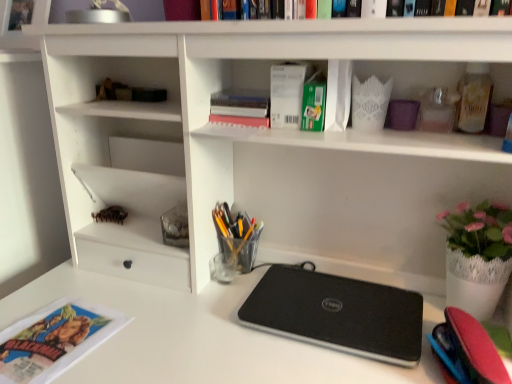
What do you see at coordinates (54, 340) in the screenshot? I see `matte paper magazine at lower left` at bounding box center [54, 340].

Find the location of a particular element. The height and width of the screenshot is (384, 512). translucent plastic cup at center is located at coordinates (237, 236).

What is the approximate width of black matte laptop at center?

It is 11.50 inches.

Locate an element on the screen. This screenshot has height=384, width=512. white matte paper at upper center, which appears as the 1th paperback book when viewed from the left is located at coordinates (287, 94).

Where is `matte paper magazine at lower left`? This screenshot has height=384, width=512. matte paper magazine at lower left is located at coordinates coord(54,340).

Considering the relative sizes of white matte paper at upper center, which appears as the 1th paperback book when viewed from the left, and translucent plastic cup at center in the image provided, is white matte paper at upper center, which appears as the 1th paperback book when viewed from the left, shorter than translucent plastic cup at center?

Indeed, white matte paper at upper center, which appears as the 1th paperback book when viewed from the left, has a lesser height compared to translucent plastic cup at center.

Is white matte paper at upper center, positioned as the 2th paperback book in right-to-left order, completely or partially outside of translucent plastic cup at center?

white matte paper at upper center, positioned as the 2th paperback book in right-to-left order, is positioned outside translucent plastic cup at center.

From the image's perspective, relative to green matte paperback book at upper center, positioned as the first paperback book in right-to-left order, is translucent plastic cup at center above or below?

From the image's perspective, translucent plastic cup at center appears below green matte paperback book at upper center, positioned as the first paperback book in right-to-left order.

Is translucent plastic cup at center behind green matte paperback book at upper center, positioned as the first paperback book in right-to-left order?

Yes, it is.

Which point is more distant from viewer, (233, 230) or (307, 92)?

Positioned behind is point (233, 230).

Is translucent plastic cup at center facing towards green matte paperback book at upper center, positioned as the first paperback book in right-to-left order?

No, translucent plastic cup at center does not turn towards green matte paperback book at upper center, positioned as the first paperback book in right-to-left order.

Is the surface of translucent plastic cup at center in direct contact with black matte laptop at center?

No, translucent plastic cup at center is not making contact with black matte laptop at center.

The image size is (512, 384). Find the location of `laptop that appears below the translucent plastic cup at center (from the image's perspective)`. laptop that appears below the translucent plastic cup at center (from the image's perspective) is located at coordinates (337, 314).

From the image's perspective, does translucent plastic cup at center appear lower than black matte laptop at center?

No.

From a real-world perspective, which object stands above the other?

From a 3D spatial view, translucent plastic cup at center is above.

From the image's perspective, does translucent plastic cup at center appear higher than white matte paper at upper center, which appears as the 1th paperback book when viewed from the left?

Incorrect, from the image's perspective, translucent plastic cup at center is lower than white matte paper at upper center, which appears as the 1th paperback book when viewed from the left.

Can you see translucent plastic cup at center touching white matte paper at upper center, positioned as the 2th paperback book in right-to-left order?

translucent plastic cup at center and white matte paper at upper center, positioned as the 2th paperback book in right-to-left order, are not in contact.

Does translucent plastic cup at center turn towards white matte paper at upper center, which appears as the 1th paperback book when viewed from the left?

No, translucent plastic cup at center does not turn towards white matte paper at upper center, which appears as the 1th paperback book when viewed from the left.

Which object is further away from the camera taking this photo, translucent plastic cup at center or white matte paper at upper center, which appears as the 1th paperback book when viewed from the left?

translucent plastic cup at center is further away from the camera.

In terms of size, does matte paper magazine at lower left appear bigger or smaller than green matte paperback book at upper center, positioned as the first paperback book in right-to-left order?

Considering their sizes, matte paper magazine at lower left takes up less space than green matte paperback book at upper center, positioned as the first paperback book in right-to-left order.

From the image's perspective, relative to green matte paperback book at upper center, positioned as the first paperback book in right-to-left order, is matte paper magazine at lower left above or below?

matte paper magazine at lower left is below green matte paperback book at upper center, positioned as the first paperback book in right-to-left order.

Does point (70, 334) lie in front of point (312, 126)?

Yes, point (70, 334) is closer to viewer.

In the scene shown: Considering the positions of objects matte paper magazine at lower left and green matte paperback book at upper center, which is the 2th paperback book from left to right, in the image provided, who is more to the left, matte paper magazine at lower left or green matte paperback book at upper center, which is the 2th paperback book from left to right,?

From the viewer's perspective, matte paper magazine at lower left appears more on the left side.

Could you tell me if green matte paperback book at upper center, which is the 2th paperback book from left to right, is turned towards matte paper magazine at lower left?

No.

Which is closer to the camera, (309,100) or (71,354)?

Point (309,100).

Looking at the image, does green matte paperback book at upper center, which is the 2th paperback book from left to right, seem bigger or smaller compared to matte paper magazine at lower left?

Clearly, green matte paperback book at upper center, which is the 2th paperback book from left to right, is larger in size than matte paper magazine at lower left.

Choose the correct answer: Is green matte paperback book at upper center, positioned as the first paperback book in right-to-left order, inside matte paper magazine at lower left or outside it?

green matte paperback book at upper center, positioned as the first paperback book in right-to-left order, is not enclosed by matte paper magazine at lower left.

Is matte paper magazine at lower left positioned with its back to pink matte book at upper center?

No, matte paper magazine at lower left's orientation is not away from pink matte book at upper center.

Would you say matte paper magazine at lower left is inside or outside pink matte book at upper center?

matte paper magazine at lower left is not inside pink matte book at upper center, it's outside.

Considering the relative positions of matte paper magazine at lower left and pink matte book at upper center in the image provided, is matte paper magazine at lower left to the right of pink matte book at upper center from the viewer's perspective?

No, matte paper magazine at lower left is not to the right of pink matte book at upper center.

From a real-world perspective, which object stands above the other?

pink matte book at upper center is physically above.

You are a GUI agent. You are given a task and a screenshot of the screen. Output one action in this format:
    pyautogui.click(x=<x>, y=<y>)
    Task: Click on the stationery below the white matte paper at upper center, positioned as the 2th paperback book in right-to-left order (from a real-world perspective)
    The image size is (512, 384).
    Given the screenshot: What is the action you would take?
    237,236

The image size is (512, 384). There is a translucent plastic cup at center. What are the coordinates of `the 1st paperback book above it (from the image's perspective)` in the screenshot? It's located at (313, 105).

From the image, which object appears to be farther from pink matte book at upper center, black matte laptop at center or green matte paperback book at upper center, positioned as the first paperback book in right-to-left order?

Based on the image, black matte laptop at center appears to be further to pink matte book at upper center.

Estimate the real-world distances between objects in this image. Which object is further from matte paper magazine at lower left, translucent plastic cup at center or green matte paperback book at upper center, positioned as the first paperback book in right-to-left order?

green matte paperback book at upper center, positioned as the first paperback book in right-to-left order, is further to matte paper magazine at lower left.

Considering their positions, is black matte laptop at center positioned further to white matte paper at upper center, positioned as the 2th paperback book in right-to-left order, than pink matte book at upper center?

Based on the image, black matte laptop at center appears to be further to white matte paper at upper center, positioned as the 2th paperback book in right-to-left order.

Estimate the real-world distances between objects in this image. Which object is closer to black matte laptop at center, white matte paper at upper center, which appears as the 1th paperback book when viewed from the left, or translucent plastic cup at center?

Among the two, translucent plastic cup at center is located nearer to black matte laptop at center.

Looking at the image, which one is located further to pink matte book at upper center, green matte paperback book at upper center, which is the 2th paperback book from left to right, or black matte laptop at center?

The object further to pink matte book at upper center is black matte laptop at center.

Looking at the image, which one is located further to black matte laptop at center, white matte paper at upper center, which appears as the 1th paperback book when viewed from the left, or green matte paperback book at upper center, positioned as the first paperback book in right-to-left order?

white matte paper at upper center, which appears as the 1th paperback book when viewed from the left.

From the image, which object appears to be nearer to green matte paperback book at upper center, which is the 2th paperback book from left to right, black matte laptop at center or pink matte book at upper center?

pink matte book at upper center lies closer to green matte paperback book at upper center, which is the 2th paperback book from left to right, than the other object.

Looking at the image, which one is located further to green matte paperback book at upper center, which is the 2th paperback book from left to right, matte paper magazine at lower left or white matte paper at upper center, which appears as the 1th paperback book when viewed from the left?

matte paper magazine at lower left is further to green matte paperback book at upper center, which is the 2th paperback book from left to right.

At what (x,y) coordinates should I click in order to perform the action: click on book that lies between green matte paperback book at upper center, positioned as the first paperback book in right-to-left order, and translucent plastic cup at center from top to bottom. Please return your answer as a coordinate pair (x, y). This screenshot has width=512, height=384. Looking at the image, I should click on (240, 103).

Image resolution: width=512 pixels, height=384 pixels. I want to click on paperback book that lies between white matte paper at upper center, which appears as the 1th paperback book when viewed from the left, and black matte laptop at center from top to bottom, so click(x=313, y=105).

This screenshot has width=512, height=384. Identify the location of book between green matte paperback book at upper center, positioned as the first paperback book in right-to-left order, and matte paper magazine at lower left, in the vertical direction. (240, 103).

The height and width of the screenshot is (384, 512). What are the coordinates of `book between white matte paper at upper center, positioned as the 2th paperback book in right-to-left order, and matte paper magazine at lower left vertically` in the screenshot? It's located at (240, 103).